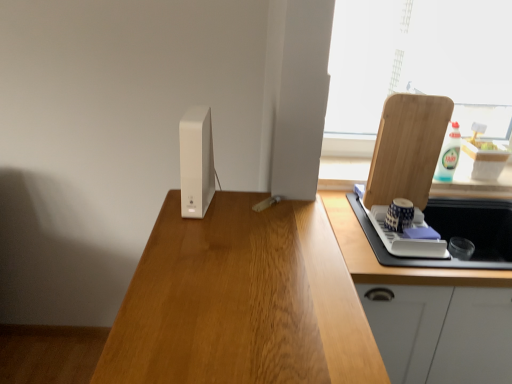
Question: Does point (390, 215) appear closer or farther from the camera than point (351, 253)?

Choices:
 (A) closer
 (B) farther

Answer: (B)

Question: Considering their positions, is blue and white ceramic cup at right, acting as the second appliance starting from the left, located in front of or behind white glossy cabinet at right?

Choices:
 (A) behind
 (B) front

Answer: (A)

Question: Which is farther from the wooden cutting board at right?

Choices:
 (A) white plastic bottle at upper right
 (B) transparent glass window at upper right
 (C) white matte router at center, which is the second appliance in bottom-to-top order
 (D) white glossy cabinet at right
 (E) blue and white ceramic cup at right, acting as the second appliance starting from the left

Answer: (B)

Question: Estimate the real-world distances between objects in this image. Which object is farther from the wooden cutting board at right?

Choices:
 (A) blue and white ceramic cup at right, acting as the second appliance starting from the top
 (B) transparent glass window at upper right
 (C) white glossy cabinet at right
 (D) white plastic bottle at upper right
 (E) white matte router at center, the 1th appliance from the top

Answer: (B)